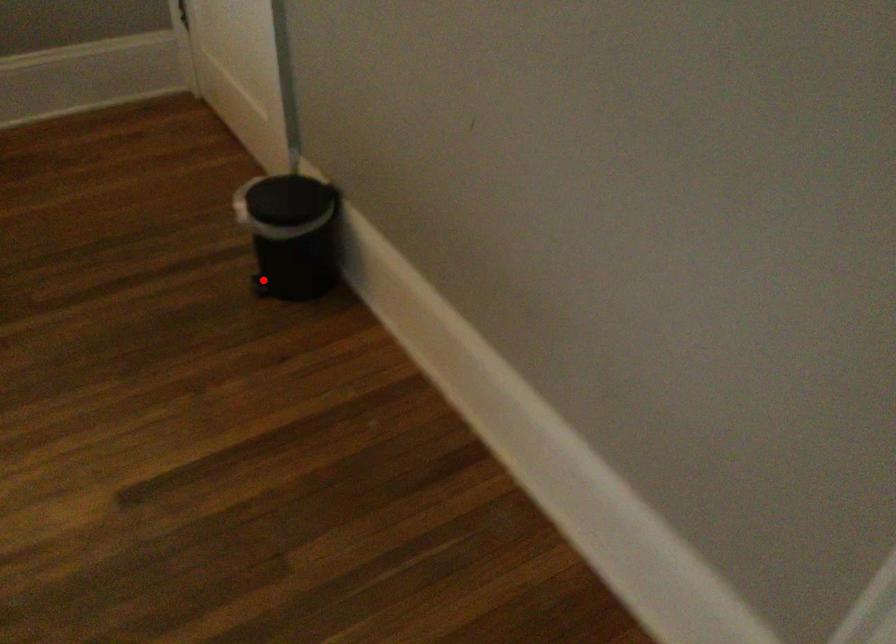
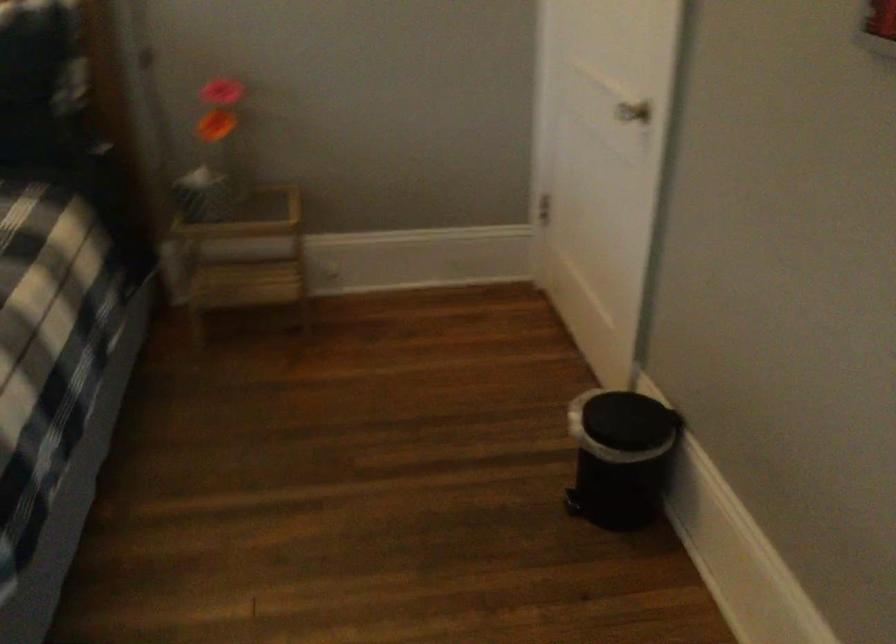
The point at the highlighted location is marked in the first image. Where is the corresponding point in the second image?

(573, 504)